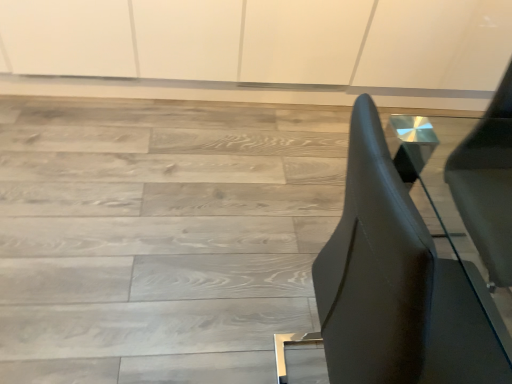
Question: Is metallic silver side table at center smaller than matte wood floor at center?

Choices:
 (A) no
 (B) yes

Answer: (B)

Question: Is metallic silver side table at center positioned before matte wood floor at center?

Choices:
 (A) no
 (B) yes

Answer: (B)

Question: Is metallic silver side table at center further to camera compared to matte wood floor at center?

Choices:
 (A) yes
 (B) no

Answer: (B)

Question: Can you confirm if metallic silver side table at center is bigger than matte wood floor at center?

Choices:
 (A) no
 (B) yes

Answer: (A)

Question: Is metallic silver side table at center to the right of matte wood floor at center from the viewer's perspective?

Choices:
 (A) yes
 (B) no

Answer: (A)

Question: Can you confirm if metallic silver side table at center is shorter than matte wood floor at center?

Choices:
 (A) no
 (B) yes

Answer: (A)

Question: Would you say matte wood floor at center is a long distance from metallic silver side table at center?

Choices:
 (A) no
 (B) yes

Answer: (A)

Question: From the image's perspective, is matte wood floor at center under metallic silver side table at center?

Choices:
 (A) yes
 (B) no

Answer: (B)

Question: Is matte wood floor at center taller than metallic silver side table at center?

Choices:
 (A) yes
 (B) no

Answer: (B)

Question: Is matte wood floor at center positioned with its back to metallic silver side table at center?

Choices:
 (A) yes
 (B) no

Answer: (B)

Question: Is matte wood floor at center to the right of metallic silver side table at center from the viewer's perspective?

Choices:
 (A) no
 (B) yes

Answer: (A)

Question: From the image's perspective, does matte wood floor at center appear higher than metallic silver side table at center?

Choices:
 (A) no
 (B) yes

Answer: (B)

Question: Looking at the image, does metallic silver side table at center seem bigger or smaller compared to matte wood floor at center?

Choices:
 (A) small
 (B) big

Answer: (A)